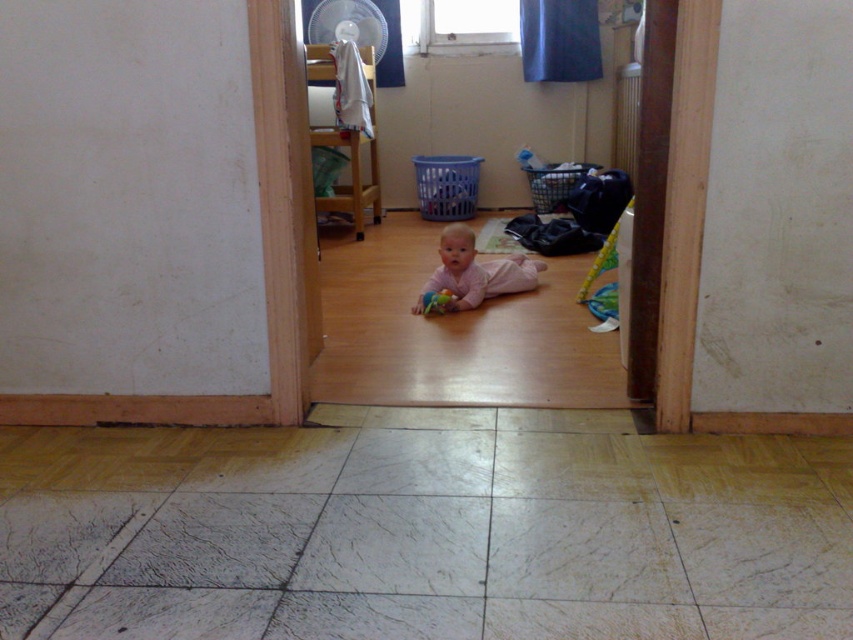
You are a parent entering the room through the doorway. You see the pink fabric baby at center and the blue plastic laundry basket at center. Which object is closer to the right side of the room?

The pink fabric baby at center is closer to the right side of the room because it is positioned to the right of the blue plastic laundry basket at center.

You are a parent entering the room through the doorway. You see the pink fabric baby at center and the blue plastic laundry basket at center. Which object is taller?

The blue plastic laundry basket at center is taller than the pink fabric baby at center.